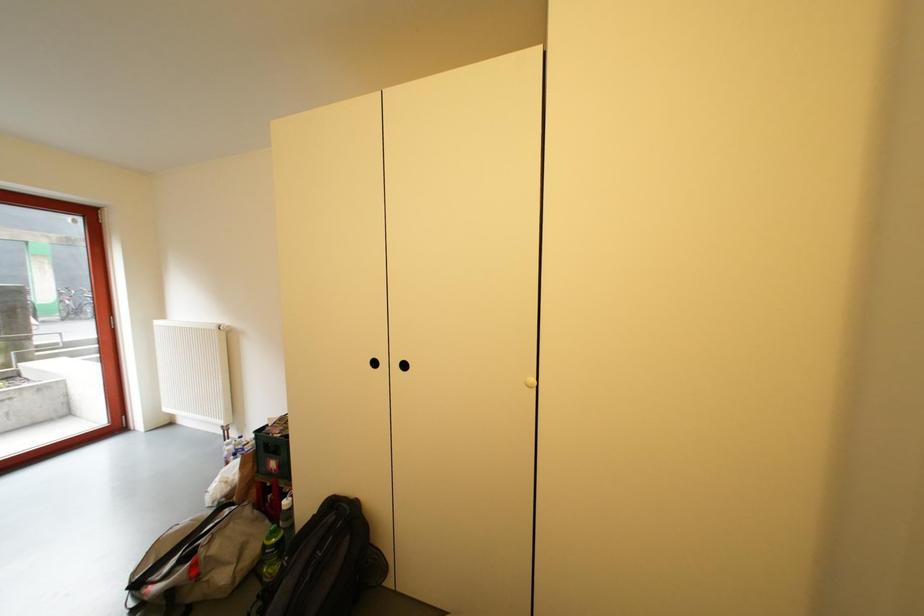
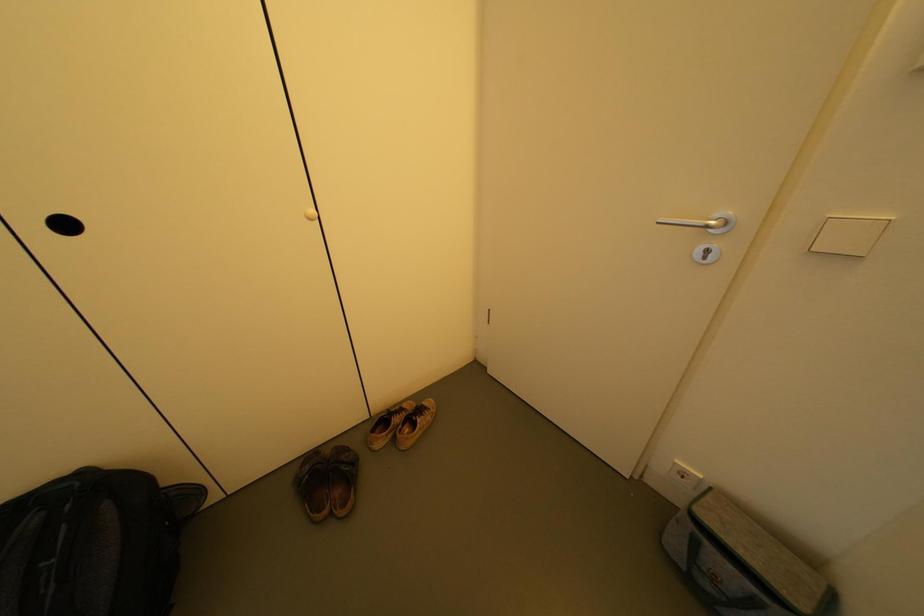
The first image is from the beginning of the video and the second image is from the end. How did the camera likely rotate when shooting the video?

The camera rotated toward right-down.